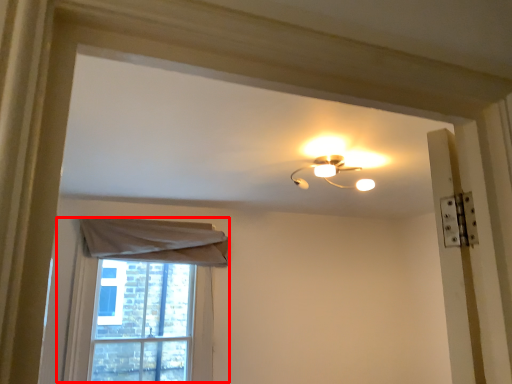
Question: Considering the relative positions of window (annotated by the red box) and lamp in the image provided, where is window (annotated by the red box) located with respect to the staircase?

Choices:
 (A) right
 (B) left

Answer: (B)